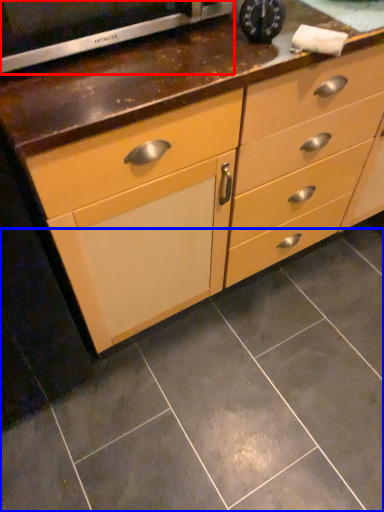
Question: Which object appears farthest to the camera in this image, appliance (highlighted by a red box) or ceramic tile (highlighted by a blue box)?

Choices:
 (A) appliance
 (B) ceramic tile

Answer: (B)